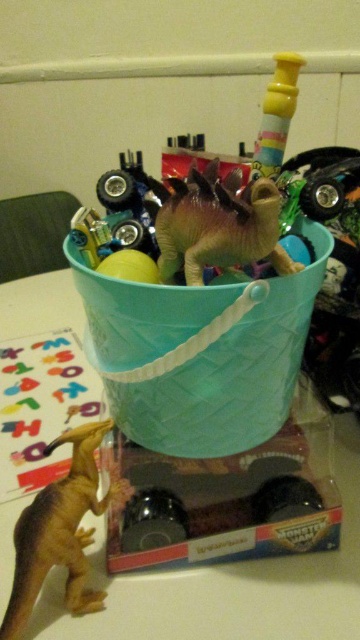
You are standing in front of the bucket and see two points marked on the ground. The first point is at coordinate point [96,618] and the second point is at coordinate point [88,481]. Which point is closer to the dinosaur figurine that is outside the bucket?

Point [96,618] is closer to the dinosaur figurine that is outside the bucket because it is in front of point [88,481], meaning it is nearer to the observer.

You are organizing a child play area and need to place the yellow matte dinosaur at lower left on the matte plastic table at lower left. Will the dinosaur fit on the table?

The matte plastic table at lower left is larger than the yellow matte dinosaur at lower left, so the dinosaur will fit on the table.